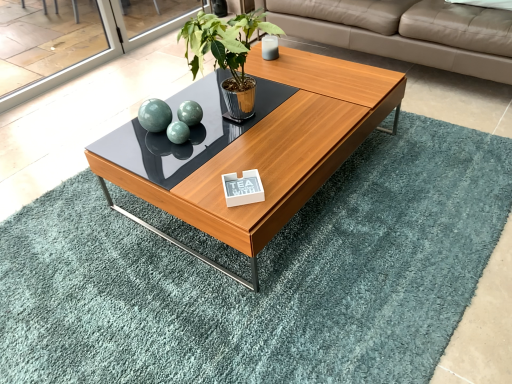
Question: Is beige leather couch at upper right not close to white glossy plaque at center?

Choices:
 (A) no
 (B) yes

Answer: (B)

Question: From a real-world perspective, is beige leather couch at upper right located higher than white glossy plaque at center?

Choices:
 (A) yes
 (B) no

Answer: (B)

Question: Can you confirm if beige leather couch at upper right is wider than white glossy plaque at center?

Choices:
 (A) yes
 (B) no

Answer: (A)

Question: Is beige leather couch at upper right thinner than white glossy plaque at center?

Choices:
 (A) yes
 (B) no

Answer: (B)

Question: Is beige leather couch at upper right closer to the viewer compared to white glossy plaque at center?

Choices:
 (A) yes
 (B) no

Answer: (B)

Question: From the image's perspective, is white glossy plaque at center positioned above or below teal rug at center?

Choices:
 (A) below
 (B) above

Answer: (B)

Question: Is white glossy plaque at center bigger or smaller than teal rug at center?

Choices:
 (A) big
 (B) small

Answer: (B)

Question: Looking at their shapes, would you say white glossy plaque at center is wider or thinner than teal rug at center?

Choices:
 (A) thin
 (B) wide

Answer: (A)

Question: From a real-world perspective, is white glossy plaque at center above or below teal rug at center?

Choices:
 (A) below
 (B) above

Answer: (B)

Question: Is point (262, 218) positioned closer to the camera than point (249, 89)?

Choices:
 (A) farther
 (B) closer

Answer: (B)

Question: In the image, is wooden coffee table at center positioned in front of or behind green leafy plant at center?

Choices:
 (A) behind
 (B) front

Answer: (B)

Question: Is wooden coffee table at center inside the boundaries of green leafy plant at center, or outside?

Choices:
 (A) outside
 (B) inside

Answer: (A)

Question: From their relative heights in the image, would you say wooden coffee table at center is taller or shorter than green leafy plant at center?

Choices:
 (A) short
 (B) tall

Answer: (A)

Question: Looking at the image, does beige leather couch at upper right seem bigger or smaller compared to wooden coffee table at center?

Choices:
 (A) big
 (B) small

Answer: (A)

Question: Does point (309, 8) appear closer or farther from the camera than point (257, 142)?

Choices:
 (A) closer
 (B) farther

Answer: (B)